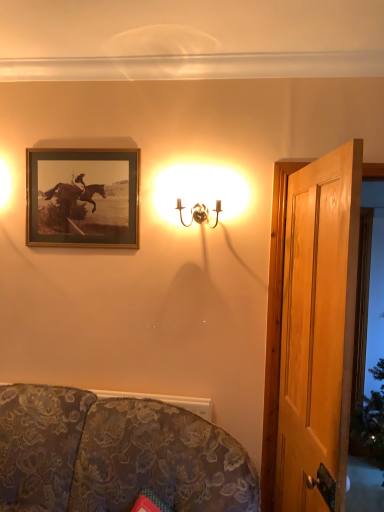
Question: Is gold metallic wall sconce at upper center outside wooden door at right?

Choices:
 (A) no
 (B) yes

Answer: (B)

Question: From a real-world perspective, is gold metallic wall sconce at upper center on wooden door at right?

Choices:
 (A) yes
 (B) no

Answer: (A)

Question: From the image's perspective, is gold metallic wall sconce at upper center located above wooden door at right?

Choices:
 (A) no
 (B) yes

Answer: (B)

Question: Is gold metallic wall sconce at upper center bigger than wooden door at right?

Choices:
 (A) no
 (B) yes

Answer: (A)

Question: Is gold metallic wall sconce at upper center at the left side of wooden door at right?

Choices:
 (A) yes
 (B) no

Answer: (A)

Question: Does gold metallic wall sconce at upper center have a greater width compared to wooden door at right?

Choices:
 (A) no
 (B) yes

Answer: (B)

Question: Is transparent glass door at right to the left of floral fabric couch at lower left from the viewer's perspective?

Choices:
 (A) yes
 (B) no

Answer: (B)

Question: Is floral fabric couch at lower left at the back of transparent glass door at right?

Choices:
 (A) no
 (B) yes

Answer: (A)

Question: From the image's perspective, would you say transparent glass door at right is shown under floral fabric couch at lower left?

Choices:
 (A) yes
 (B) no

Answer: (B)

Question: Can you confirm if transparent glass door at right is bigger than floral fabric couch at lower left?

Choices:
 (A) no
 (B) yes

Answer: (A)

Question: From the image's perspective, is transparent glass door at right on floral fabric couch at lower left?

Choices:
 (A) no
 (B) yes

Answer: (B)

Question: Is transparent glass door at right smaller than floral fabric couch at lower left?

Choices:
 (A) yes
 (B) no

Answer: (A)

Question: Is wooden door at right to the right of gold metallic wall sconce at upper center from the viewer's perspective?

Choices:
 (A) yes
 (B) no

Answer: (A)